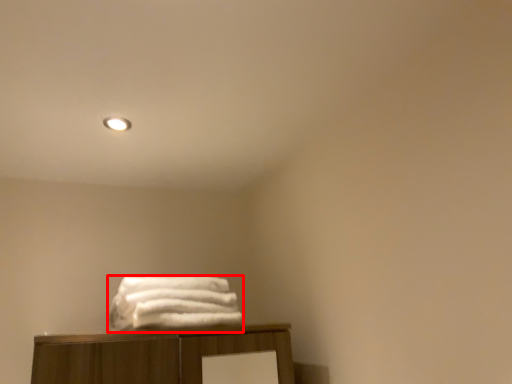
Question: From the image's perspective, where is towel (annotated by the red box) located in relation to lighting in the image?

Choices:
 (A) above
 (B) below

Answer: (B)